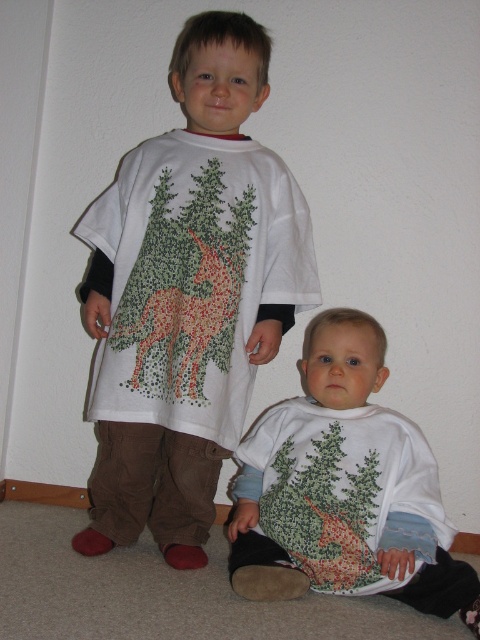
Question: Can you confirm if white matte t-shirt at center is smaller than white soft fabric shirt at lower center?

Choices:
 (A) yes
 (B) no

Answer: (B)

Question: Can you confirm if white matte t-shirt at center is positioned above white soft fabric shirt at lower center?

Choices:
 (A) no
 (B) yes

Answer: (B)

Question: Which point is farther from the camera taking this photo?

Choices:
 (A) (331, 506)
 (B) (191, 490)

Answer: (B)

Question: Among these objects, which one is farthest from the camera?

Choices:
 (A) white soft fabric shirt at lower center
 (B) white matte t-shirt at center

Answer: (B)

Question: In this image, where is white matte t-shirt at center located relative to white soft fabric shirt at lower center?

Choices:
 (A) above
 (B) below

Answer: (A)